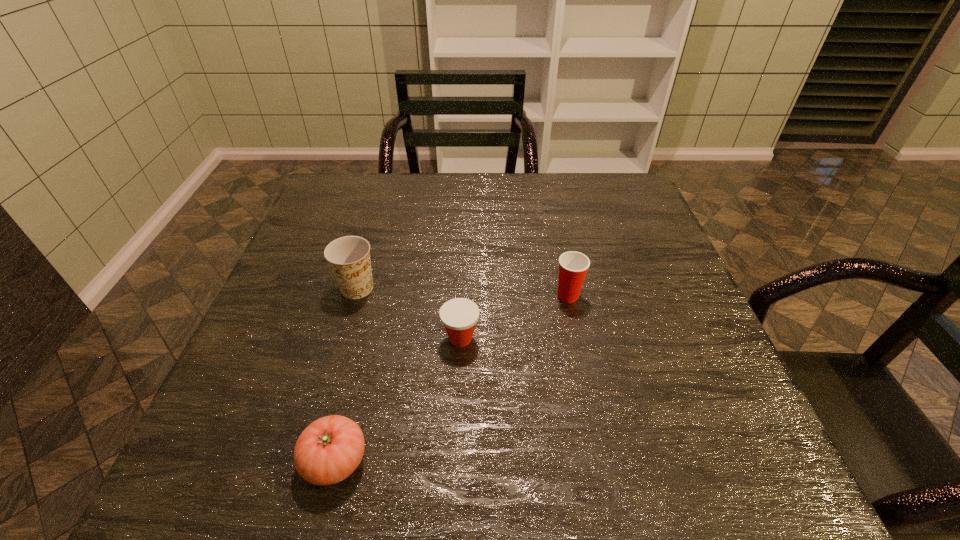
Where is `the leftmost Dixie cup`? Image resolution: width=960 pixels, height=540 pixels. the leftmost Dixie cup is located at coordinates (349, 257).

I want to click on the rightmost Dixie cup, so click(x=573, y=266).

I want to click on the third farthest object, so click(x=459, y=316).

The image size is (960, 540). I want to click on the third object from left to right, so click(459, 316).

Identify the location of the nearest object. pos(329,450).

Find the location of a particular element. The height and width of the screenshot is (540, 960). free space located on the right of the leftmost Dixie cup is located at coordinates (512, 288).

Where is `vacant space positioned on the left of the rightmost Dixie cup`? This screenshot has width=960, height=540. vacant space positioned on the left of the rightmost Dixie cup is located at coordinates (396, 295).

Locate an element on the screen. The height and width of the screenshot is (540, 960). free region located on the back of the third farthest object is located at coordinates (463, 280).

This screenshot has height=540, width=960. I want to click on blank space located on the right of the tomato, so click(514, 460).

Identify the location of object that is positioned at the near edge. The image size is (960, 540). (329, 450).